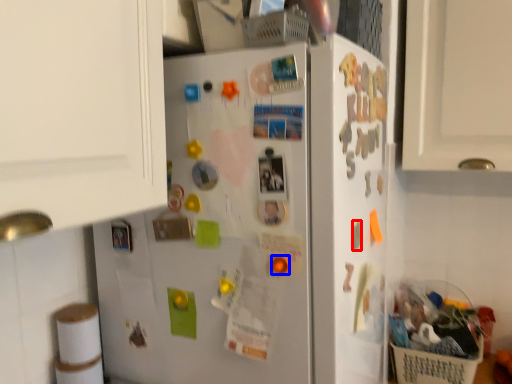
Question: Which point is closer to the camera, magnet (highlighted by a red box) or magnet (highlighted by a blue box)?

Choices:
 (A) magnet
 (B) magnet

Answer: (B)